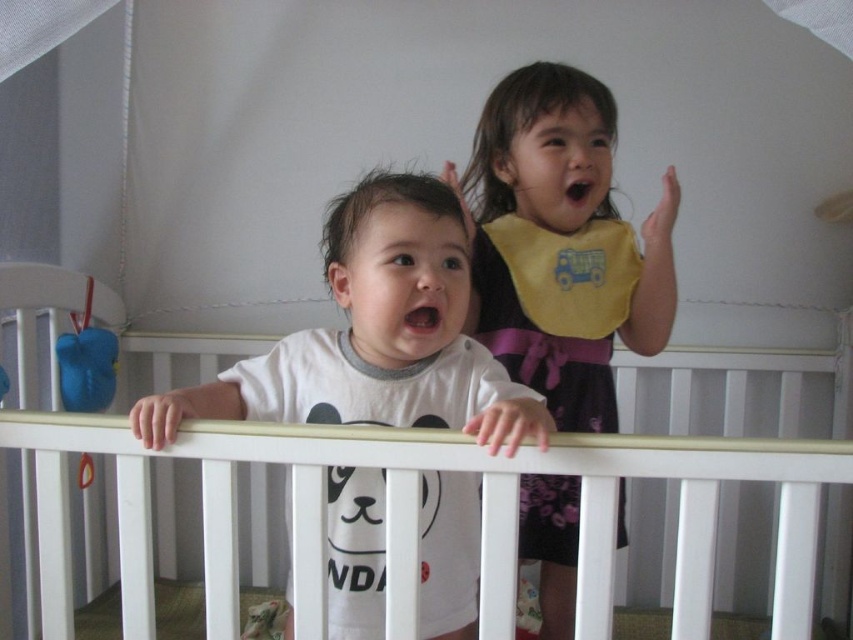
You are a parent trying to locate your child who is hiding in the nursery. You see the white wooden crib at center and the blue rubber duck at left. Which object is closer to the left side of the room?

The blue rubber duck at left is closer to the left side of the room because it is positioned to the left of the white wooden crib at center.